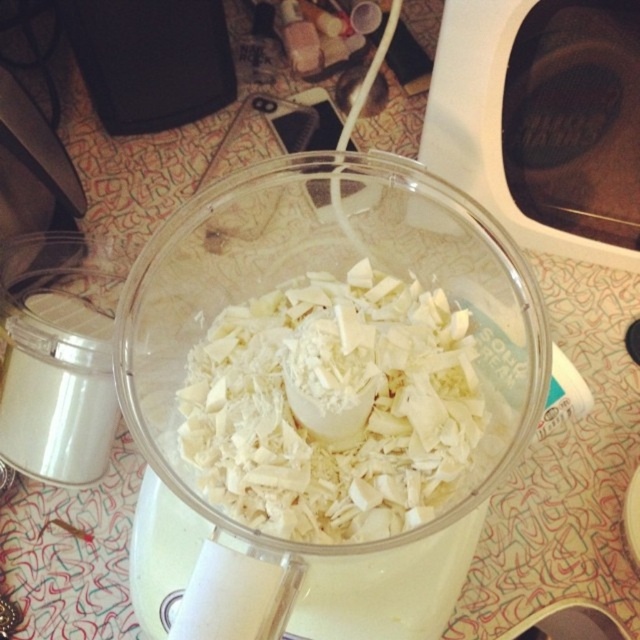
Who is higher up, transparent plastic bowl at center or white shredded coconut at center?

white shredded coconut at center

This screenshot has height=640, width=640. What do you see at coordinates (291, 282) in the screenshot? I see `transparent plastic bowl at center` at bounding box center [291, 282].

Image resolution: width=640 pixels, height=640 pixels. What are the coordinates of `transparent plastic bowl at center` in the screenshot? It's located at (291, 282).